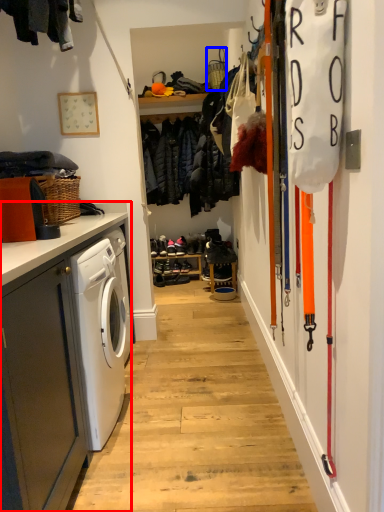
Question: Which point is further to the camera, cabinetry (highlighted by a red box) or basket (highlighted by a blue box)?

Choices:
 (A) cabinetry
 (B) basket

Answer: (B)